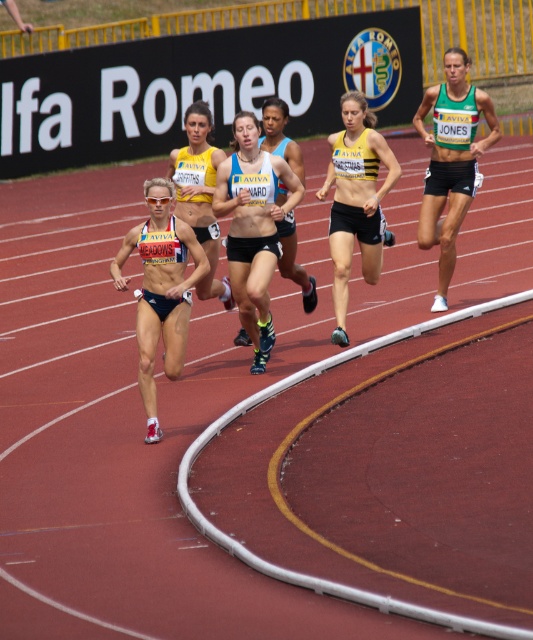
Which of these two, matte black running suit at center or matte blue tank top at center, stands taller?

matte black running suit at center is taller.

Is the position of matte black running suit at center more distant than that of matte blue tank top at center?

No, it is not.

What do you see at coordinates (199, 195) in the screenshot? This screenshot has width=533, height=640. I see `matte black running suit at center` at bounding box center [199, 195].

Where is `matte black running suit at center`? matte black running suit at center is located at coordinates (199, 195).

Does matte black shorts at center appear over green fabric tank top at right?

No.

Is point (156, 333) more distant than point (456, 131)?

No, it is not.

What do you see at coordinates (160, 291) in the screenshot?
I see `matte black shorts at center` at bounding box center [160, 291].

You are a GUI agent. You are given a task and a screenshot of the screen. Output one action in this format:
    pyautogui.click(x=<x>, y=<y>)
    Task: Click on the matte black shorts at center
    
    Given the screenshot: What is the action you would take?
    pyautogui.click(x=160, y=291)

Which is in front, point (241, 132) or point (287, 157)?

Point (241, 132) is more forward.

Describe the element at coordinates (254, 227) in the screenshot. I see `matte blue shorts at center` at that location.

Identify the location of matte blue shorts at center. The image size is (533, 640). (254, 227).